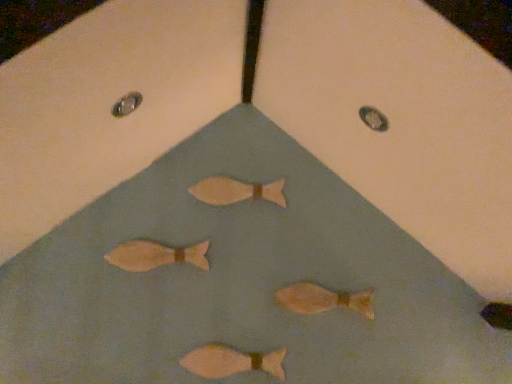
Question: Are matte wooden fish at center, positioned as the fourth fish in bottom-to-top order, and matte brown fish at center, the 2th fish viewed from the top, making contact?

Choices:
 (A) no
 (B) yes

Answer: (A)

Question: Can you confirm if matte wooden fish at center, positioned as the fourth fish in bottom-to-top order, is taller than matte brown fish at center, the 2th fish viewed from the top?

Choices:
 (A) yes
 (B) no

Answer: (B)

Question: Does matte wooden fish at center, positioned as the first fish in top-to-bottom order, have a lesser height compared to matte brown fish at center, the third fish positioned from the bottom?

Choices:
 (A) yes
 (B) no

Answer: (A)

Question: Does matte wooden fish at center, positioned as the fourth fish in bottom-to-top order, appear on the right side of matte brown fish at center, the third fish positioned from the bottom?

Choices:
 (A) yes
 (B) no

Answer: (A)

Question: Is matte brown fish at center, the 2th fish viewed from the top, a part of matte wooden fish at center, positioned as the fourth fish in bottom-to-top order?

Choices:
 (A) yes
 (B) no

Answer: (B)

Question: Does matte wooden fish at center, positioned as the fourth fish in bottom-to-top order, lie behind matte brown fish at center, the 2th fish viewed from the top?

Choices:
 (A) yes
 (B) no

Answer: (A)

Question: Is matte wooden fish at center, positioned as the fourth fish in bottom-to-top order, not within matte orange fish at center, which appears as the 3th fish when viewed from the top?

Choices:
 (A) yes
 (B) no

Answer: (A)

Question: Does matte wooden fish at center, positioned as the first fish in top-to-bottom order, appear on the left side of matte orange fish at center, which appears as the 3th fish when viewed from the top?

Choices:
 (A) yes
 (B) no

Answer: (A)

Question: Is the position of matte wooden fish at center, positioned as the fourth fish in bottom-to-top order, more distant than that of matte orange fish at center, the second fish ordered from the bottom?

Choices:
 (A) yes
 (B) no

Answer: (A)

Question: Does matte wooden fish at center, positioned as the fourth fish in bottom-to-top order, have a lesser width compared to matte orange fish at center, the second fish ordered from the bottom?

Choices:
 (A) no
 (B) yes

Answer: (B)

Question: Is matte wooden fish at center, positioned as the first fish in top-to-bottom order, in front of matte orange fish at center, the second fish ordered from the bottom?

Choices:
 (A) yes
 (B) no

Answer: (B)

Question: Is matte wooden fish at center, positioned as the fourth fish in bottom-to-top order, placed right next to matte orange fish at center, which appears as the 3th fish when viewed from the top?

Choices:
 (A) yes
 (B) no

Answer: (B)

Question: Would you say matte orange fish at center, the second fish ordered from the bottom, is a long distance from matte pink fish at center, marked as the fourth fish in a top-to-bottom arrangement?

Choices:
 (A) no
 (B) yes

Answer: (A)